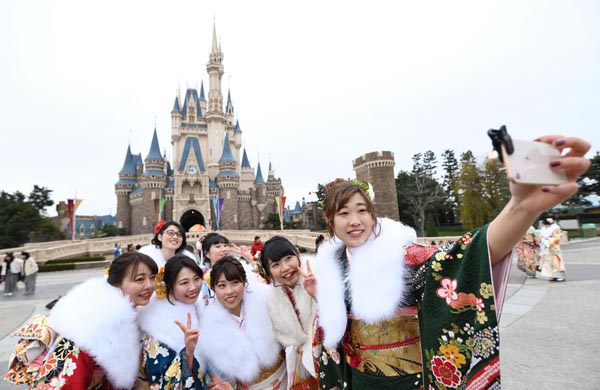
At what (x,y) coordinates should I click in order to perform the action: click on phone. Please return your answer as a coordinate pair (x, y). This screenshot has width=600, height=390. Looking at the image, I should click on (527, 164).